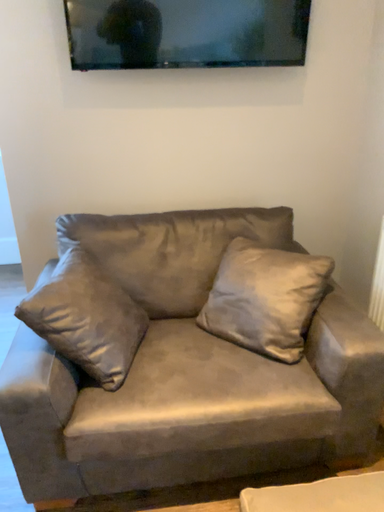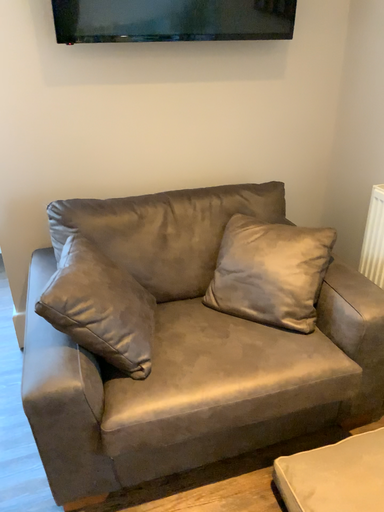
Question: Which way did the camera rotate in the video?

Choices:
 (A) rotated right
 (B) rotated left

Answer: (A)